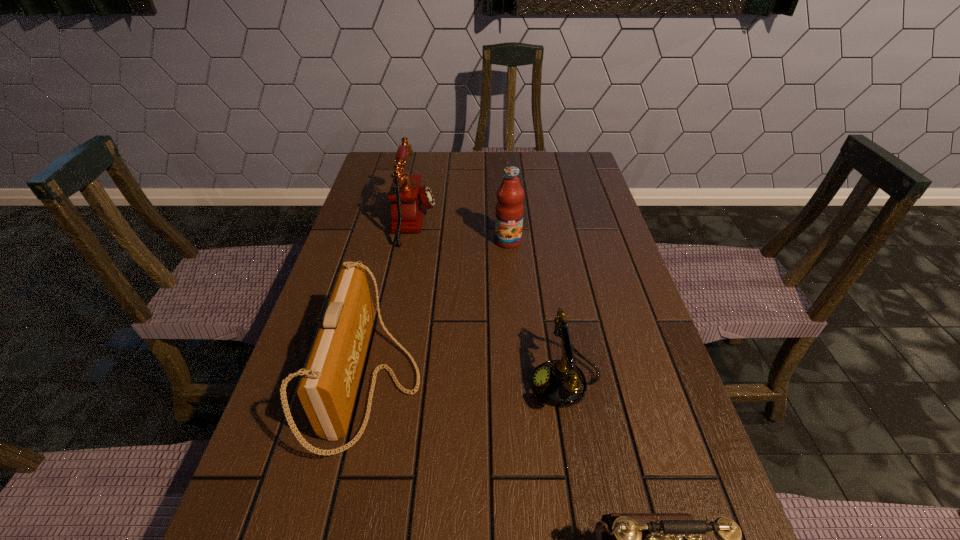
I want to click on fruit juice, so click(509, 211).

At what (x,y) coordinates should I click in order to perform the action: click on the tallest telephone. Please return your answer as a coordinate pair (x, y). The image size is (960, 540). Looking at the image, I should click on (408, 199).

You are a GUI agent. You are given a task and a screenshot of the screen. Output one action in this format:
    pyautogui.click(x=<x>, y=<y>)
    Task: Click on the farthest telephone
    The image size is (960, 540).
    Given the screenshot: What is the action you would take?
    pyautogui.click(x=408, y=199)

This screenshot has height=540, width=960. I want to click on handbag, so [x=327, y=389].

Find the location of a particular element. The image size is (960, 540). the second nearest telephone is located at coordinates (560, 383).

This screenshot has height=540, width=960. I want to click on vacant space located on the front label of the fruit juice, so click(516, 354).

At what (x,y) coordinates should I click in order to perform the action: click on free region located on the dial of the leftmost telephone. Please return your answer as a coordinate pair (x, y). The width and height of the screenshot is (960, 540). Looking at the image, I should click on (483, 222).

Identify the location of free space located on the decorative side of the third shortest object. (579, 382).

I want to click on free space located 0.190m on the dial of the second nearest telephone, so click(438, 382).

Find the location of a particular element. The image size is (960, 540). free spot located 0.060m on the dial of the second nearest telephone is located at coordinates (503, 382).